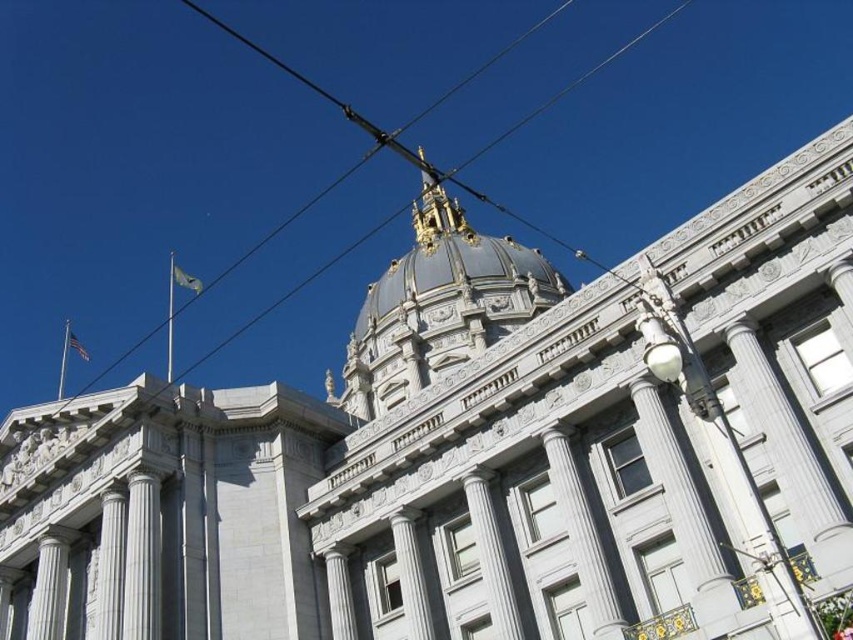
Question: In this image, where is white marble column at center located relative to blue fabric flag at upper left?

Choices:
 (A) above
 (B) below

Answer: (B)

Question: Can you confirm if metallic wire at upper center is bigger than white marble column at center?

Choices:
 (A) no
 (B) yes

Answer: (B)

Question: Which object is positioned closest to the white flagpole at upper left?

Choices:
 (A) white marble column at center
 (B) blue fabric flag at upper left
 (C) silver metallic flagpole at upper left
 (D) white fabric flag at upper left

Answer: (D)

Question: Estimate the real-world distances between objects in this image. Which object is farther from the white flagpole at upper left?

Choices:
 (A) metallic wire at upper center
 (B) white fabric flag at upper left
 (C) white marble column at center

Answer: (C)

Question: Considering the real-world distances, which object is closest to the blue fabric flag at upper left?

Choices:
 (A) metallic wire at upper center
 (B) white flagpole at upper left
 (C) silver metallic flagpole at upper left
 (D) white fabric flag at upper left

Answer: (C)

Question: Is metallic wire at upper center smaller than blue fabric flag at upper left?

Choices:
 (A) yes
 (B) no

Answer: (B)